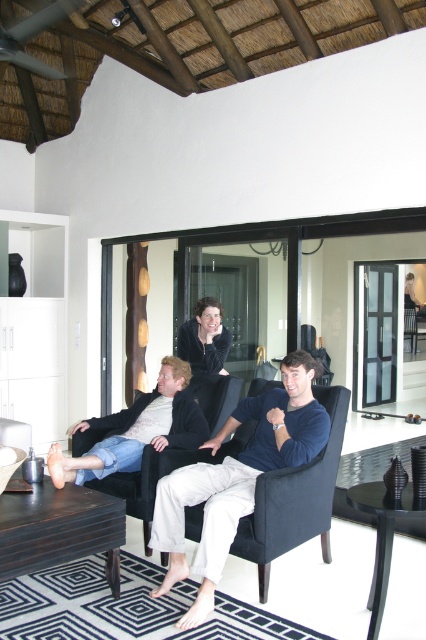
You are designing a layout for a small living room and need to place a sofa that is 1.2 meters wide. You have two options in the image, the dark blue fabric armchair at center and the matte black jacket at center. Which object can accommodate the sofa if it needs to be wider than the object?

The dark blue fabric armchair at center has a larger width than the matte black jacket at center, so the sofa can be placed wider than the dark blue fabric armchair at center.